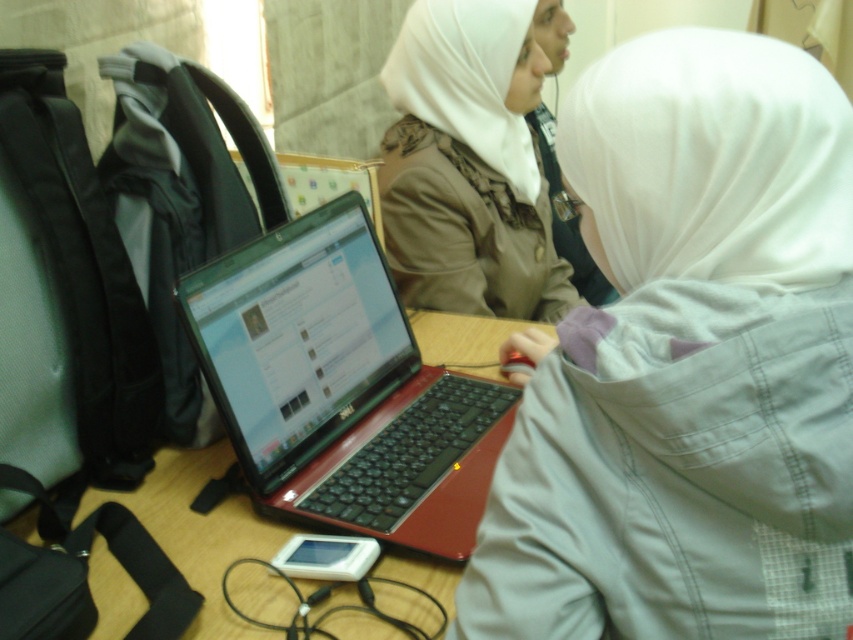
Does white matte hijab at center have a lesser height compared to white soft veil at upper right?

Incorrect, white matte hijab at center's height does not fall short of white soft veil at upper right's.

Can you confirm if white matte hijab at center is positioned to the left of white soft veil at upper right?

Indeed, white matte hijab at center is positioned on the left side of white soft veil at upper right.

The image size is (853, 640). Describe the element at coordinates (688, 364) in the screenshot. I see `white matte hijab at center` at that location.

At what (x,y) coordinates should I click in order to perform the action: click on white matte hijab at center. Please return your answer as a coordinate pair (x, y). The height and width of the screenshot is (640, 853). Looking at the image, I should click on (688, 364).

Measure the distance from white matte hijab at center to matte beige hijab at upper center.

white matte hijab at center and matte beige hijab at upper center are 33.69 inches apart.

Looking at this image, does white matte hijab at center appear under matte beige hijab at upper center?

Indeed, white matte hijab at center is positioned under matte beige hijab at upper center.

Between point (843, 259) and point (515, 52), which one is positioned behind?

The point (515, 52) is behind.

The width and height of the screenshot is (853, 640). In order to click on white matte hijab at center in this screenshot , I will do `click(688, 364)`.

Is shiny black laptop at center to the left of white matte veil at upper center from the viewer's perspective?

A: Indeed, shiny black laptop at center is positioned on the left side of white matte veil at upper center.

Can you confirm if shiny black laptop at center is positioned above white matte veil at upper center?

Incorrect, shiny black laptop at center is not positioned above white matte veil at upper center.

Where is `shiny black laptop at center`? shiny black laptop at center is located at coordinates (341, 387).